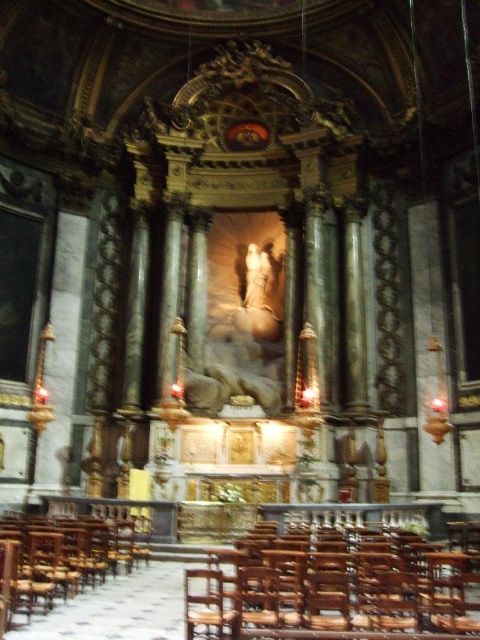
You are an interior designer assessing the church layout. You need to place a tall plant that requires 2 meters of vertical space. Which chair, the wooden polished chair at lower center or the wooden chair at left, should you avoid placing the plant next to to ensure it has enough space?

The wooden polished chair at lower center has a lesser height compared to the wooden chair at left. Therefore, you should avoid placing the plant next to the wooden polished chair at lower center since it requires 2 meters of vertical space, and the shorter chair might obstruct the plant growth.

Based on the photo, you are a visitor standing at the entrance of the church and want to sit down. You see the wooden polished chair at lower center and the wooden chair at left. Which chair is closer to you?

The wooden polished chair at lower center is closer to you since it is in front of the wooden chair at left.